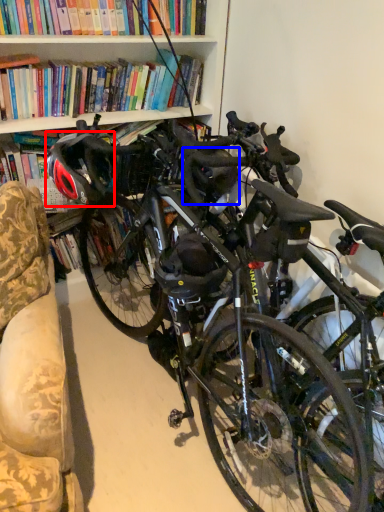
Question: Which object appears closest to the camera in this image, bicycle helmet (highlighted by a red box) or helmet (highlighted by a blue box)?

Choices:
 (A) bicycle helmet
 (B) helmet

Answer: (A)